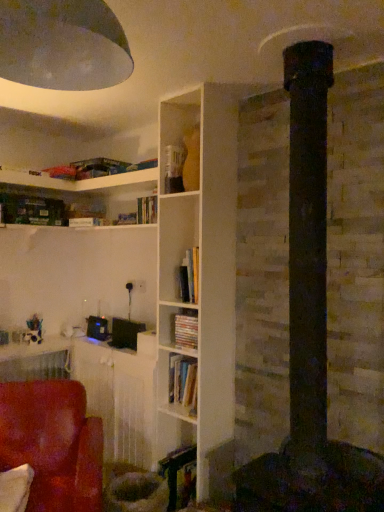
Question: Considering the positions of point (185, 313) and point (152, 352), is point (185, 313) closer or farther from the camera than point (152, 352)?

Choices:
 (A) farther
 (B) closer

Answer: (B)

Question: Is matte cardboard book at center spatially inside wooden table at lower left, or outside of it?

Choices:
 (A) outside
 (B) inside

Answer: (A)

Question: Estimate the real-world distances between objects in this image. Which object is farther from the suede-like red chair at lower left?

Choices:
 (A) matte cardboard book at center
 (B) metallic dome at upper left
 (C) wooden table at lower left

Answer: (B)

Question: Which of these objects is positioned closest to the matte cardboard book at center?

Choices:
 (A) suede-like red chair at lower left
 (B) wooden table at lower left
 (C) metallic dome at upper left

Answer: (B)